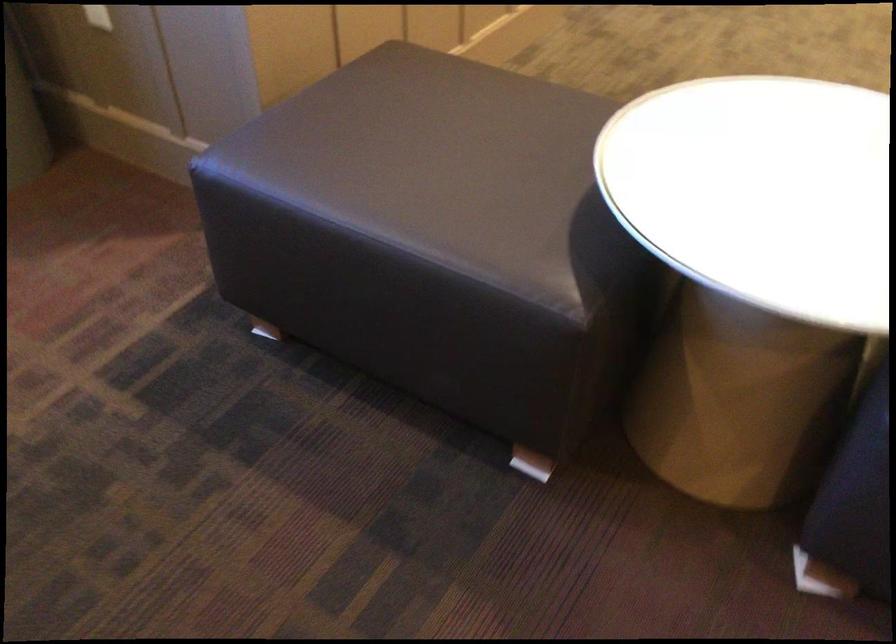
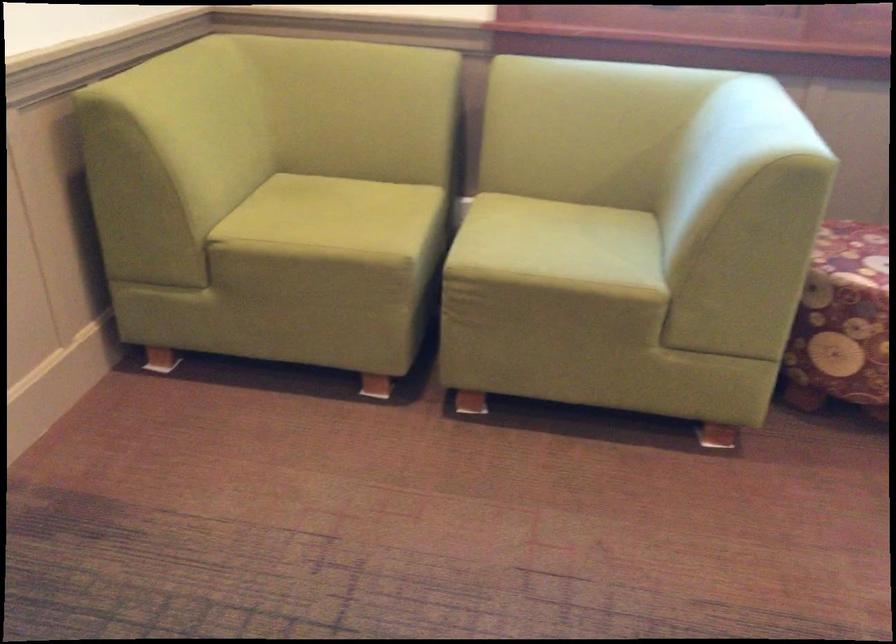
Question: The camera is either moving clockwise (left) or counter-clockwise (right) around the object. The first image is from the beginning of the video and the second image is from the end. Is the camera moving left or right when shooting the video?

Choices:
 (A) Left
 (B) Right

Answer: (B)